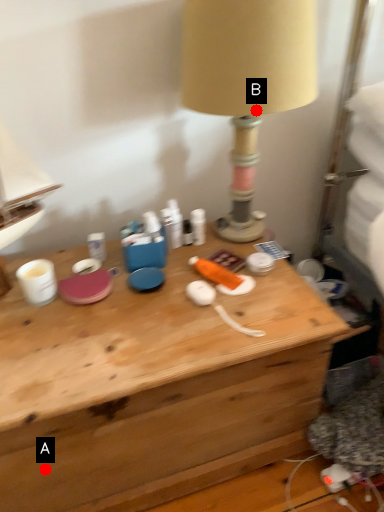
Question: Two points are circled on the image, labeled by A and B beside each circle. Among these points, which one is farthest from the camera?

Choices:
 (A) A is further
 (B) B is further

Answer: (B)